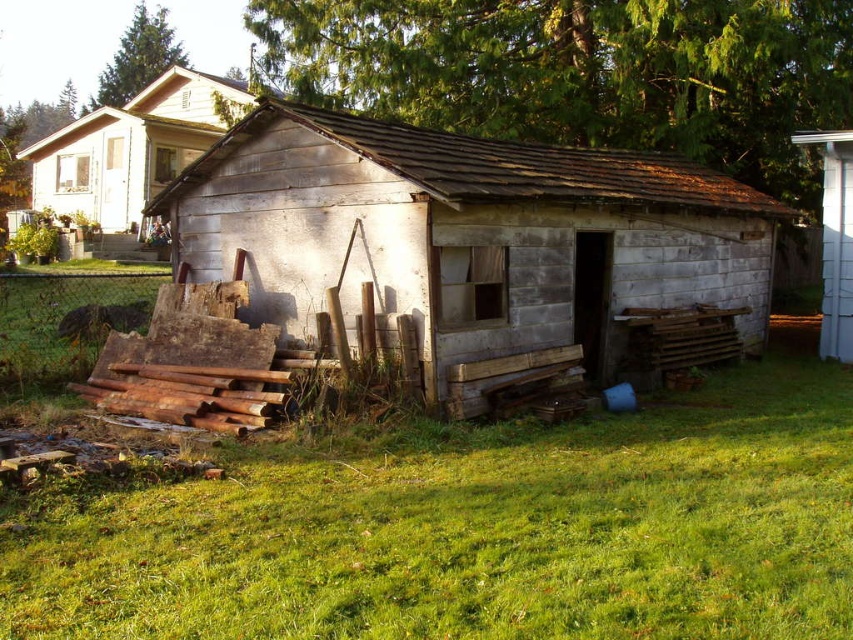
From the picture: You are planning to build a new garden shed in your backyard. You have two options for the shed design based on the image provided. The first option is the weathered wood hut at center, and the second is the white wood fence at right. If you want a shed that is wider than the fence, which option should you choose?

You should choose the weathered wood hut at center because its width is larger than the white wood fence at right.

You are standing in front of the shed and want to determine the spatial relationship between two points. Which point is closer to you, point 1 at coordinates (x=76, y=141) or point 2 at coordinates (x=844, y=355)?

Point 1 at coordinates (x=76, y=141) is closer to you because it is further to the viewer than point 2 at coordinates (x=844, y=355).

You are standing in front of the shed and want to pick up an item. There are two points marked in the image, point 1 at coordinates (x=439, y=536) and point 2 at coordinates (x=119, y=196). Which point is closer to you?

Point 1 at coordinates (x=439, y=536) is closer to you than point 2 at coordinates (x=119, y=196).